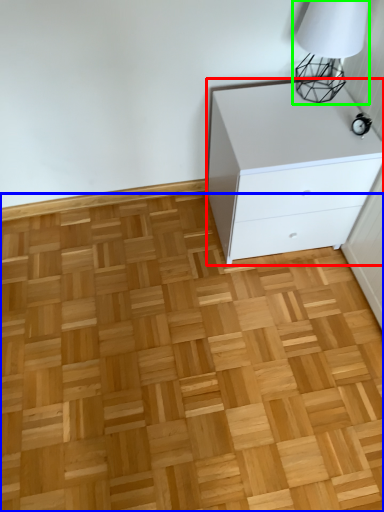
Question: Considering the real-world distances, which object is closest to chest of drawers (highlighted by a red box)? hardwood (highlighted by a blue box) or table lamp (highlighted by a green box).

Choices:
 (A) hardwood
 (B) table lamp

Answer: (B)